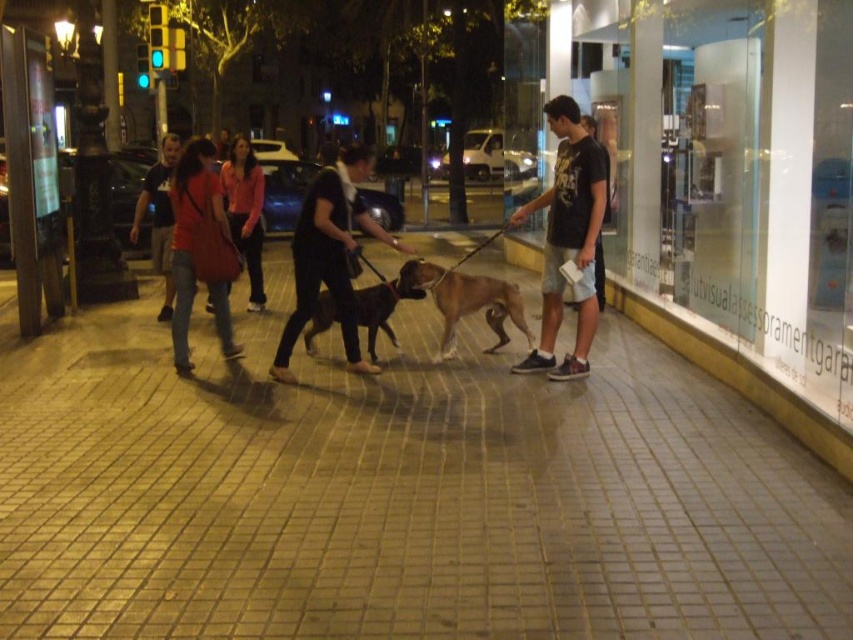
Question: Which of these objects is positioned farthest from the matte black shirt at left?

Choices:
 (A) dark gray t-shirt at center
 (B) brick pavement at center
 (C) dark gray fabric pants at center

Answer: (B)

Question: Does dark gray fabric pants at center appear on the left side of matte red jacket at center?

Choices:
 (A) no
 (B) yes

Answer: (A)

Question: From the image, what is the correct spatial relationship of brick pavement at center in relation to brown fur dog at center?

Choices:
 (A) above
 (B) below

Answer: (B)

Question: Estimate the real-world distances between objects in this image. Which object is closer to the brown fur dog at center?

Choices:
 (A) matte pink shirt at center
 (B) brick pavement at center
 (C) dark gray fabric pants at center

Answer: (C)

Question: Which object appears farthest from the camera in this image?

Choices:
 (A) matte black shirt at left
 (B) matte pink shirt at center
 (C) dark gray t-shirt at center
 (D) dark gray fabric pants at center

Answer: (B)

Question: Can you confirm if brown fur dog at center is positioned to the left of matte black shirt at left?

Choices:
 (A) yes
 (B) no

Answer: (B)